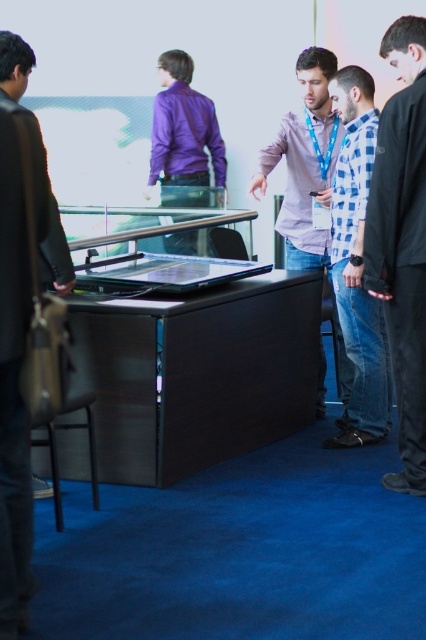
You are standing at the center of the scene and want to greet the black cotton shirt at right. In which direction should you move to approach them?

Since the black cotton shirt at right is located at point 0.378 on the x and 0.944 on the y axis, you should move to the right and slightly forward to approach them.